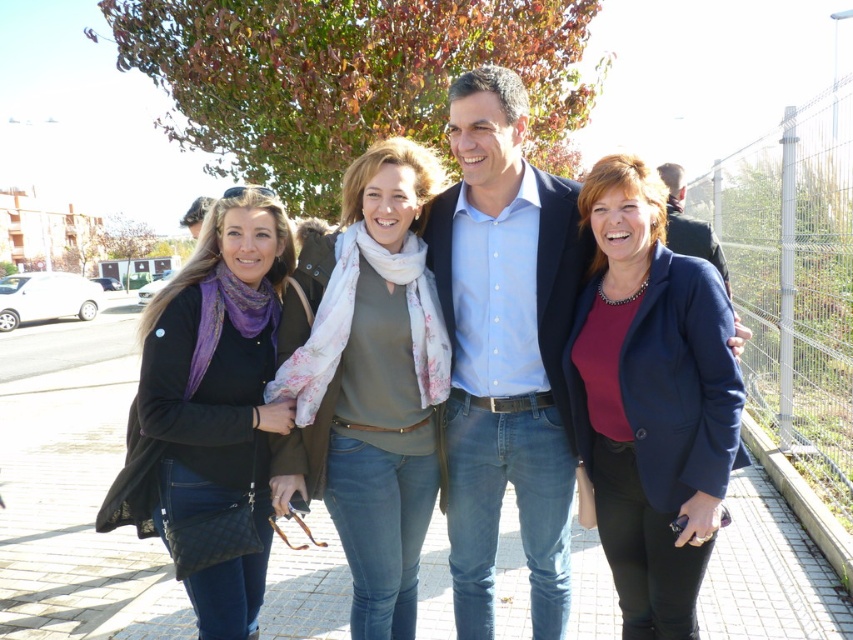
Is blue cotton shirt at center above blue denim jeans at center?

Incorrect, blue cotton shirt at center is not positioned above blue denim jeans at center.

Which is behind, point (532, 394) or point (664, 170)?

Positioned behind is point (664, 170).

The height and width of the screenshot is (640, 853). Identify the location of blue cotton shirt at center. (505, 349).

The height and width of the screenshot is (640, 853). I want to click on blue cotton shirt at center, so click(505, 349).

Between floral scarf at center and black quilted jacket at left, which one appears on the right side from the viewer's perspective?

floral scarf at center is more to the right.

Which is in front, point (428, 422) or point (248, 424)?

Point (248, 424)

Is point (366, 396) positioned after point (236, 618)?

Yes, point (366, 396) is farther from viewer.

You are a GUI agent. You are given a task and a screenshot of the screen. Output one action in this format:
    pyautogui.click(x=<x>, y=<y>)
    Task: Click on the floral scarf at center
    The width and height of the screenshot is (853, 640).
    Given the screenshot: What is the action you would take?
    tap(367, 381)

Who is positioned more to the left, matte black jacket at center or matte blue blazer at center?

From the viewer's perspective, matte black jacket at center appears more on the left side.

At what (x,y) coordinates should I click in order to perform the action: click on matte black jacket at center. Please return your answer as a coordinate pair (x, y). Looking at the image, I should click on (508, 349).

Which is in front, point (495, 538) or point (619, 564)?

Point (619, 564) is more forward.

Image resolution: width=853 pixels, height=640 pixels. I want to click on matte black jacket at center, so click(508, 349).